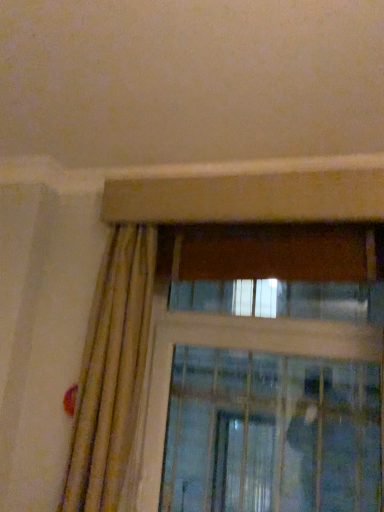
What do you see at coordinates (112, 372) in the screenshot? This screenshot has width=384, height=512. I see `beige textured curtain at left` at bounding box center [112, 372].

The height and width of the screenshot is (512, 384). What are the coordinates of `beige textured curtain at left` in the screenshot? It's located at (112, 372).

Measure the distance between beige textured curtain at left and camera.

A distance of 4.16 feet exists between beige textured curtain at left and camera.

Where is `clear glass screen door at upper center`? The width and height of the screenshot is (384, 512). clear glass screen door at upper center is located at coordinates (271, 434).

Describe the element at coordinates (271, 434) in the screenshot. The image size is (384, 512). I see `clear glass screen door at upper center` at that location.

Locate an element on the screen. This screenshot has height=512, width=384. beige textured curtain at left is located at coordinates (112, 372).

Is clear glass screen door at upper center at the left side of beige textured curtain at left?

No, clear glass screen door at upper center is not to the left of beige textured curtain at left.

Is clear glass screen door at upper center positioned in front of beige textured curtain at left?

No, it is not.

Does point (376, 496) appear closer or farther from the camera than point (97, 376)?

Clearly, point (376, 496) is more distant from the camera than point (97, 376).

From the image's perspective, which object appears higher, clear glass screen door at upper center or beige textured curtain at left?

beige textured curtain at left.

From a real-world perspective, is clear glass screen door at upper center below beige textured curtain at left?

Indeed, from a real-world perspective, clear glass screen door at upper center is positioned beneath beige textured curtain at left.

Looking at this image, considering the sizes of objects clear glass screen door at upper center and beige textured curtain at left in the image provided, who is wider, clear glass screen door at upper center or beige textured curtain at left?

Wider between the two is beige textured curtain at left.

Considering the sizes of clear glass screen door at upper center and beige textured curtain at left in the image, is clear glass screen door at upper center taller or shorter than beige textured curtain at left?

clear glass screen door at upper center is shorter than beige textured curtain at left.

Considering the sizes of objects clear glass screen door at upper center and beige textured curtain at left in the image provided, who is bigger, clear glass screen door at upper center or beige textured curtain at left?

With larger size is clear glass screen door at upper center.

Is clear glass screen door at upper center outside of beige textured curtain at left?

Indeed, clear glass screen door at upper center is completely outside beige textured curtain at left.

Is clear glass screen door at upper center positioned far away from beige textured curtain at left?

Actually, clear glass screen door at upper center and beige textured curtain at left are a little close together.

Is clear glass screen door at upper center aimed at beige textured curtain at left?

Yes, clear glass screen door at upper center is turned towards beige textured curtain at left.

Find the location of a particular element. The width and height of the screenshot is (384, 512). curtain in front of the clear glass screen door at upper center is located at coordinates (112, 372).

Considering the relative positions of beige textured curtain at left and clear glass screen door at upper center in the image provided, is beige textured curtain at left to the right of clear glass screen door at upper center from the viewer's perspective?

No.

Is beige textured curtain at left positioned behind clear glass screen door at upper center?

That is False.

Does point (107, 338) appear closer or farther from the camera than point (169, 441)?

Point (107, 338) is positioned closer to the camera compared to point (169, 441).

From the image's perspective, is beige textured curtain at left located above or below clear glass screen door at upper center?

From the image's perspective, beige textured curtain at left appears above clear glass screen door at upper center.

From a real-world perspective, does beige textured curtain at left sit lower than clear glass screen door at upper center?

No.

Considering the sizes of objects beige textured curtain at left and clear glass screen door at upper center in the image provided, who is thinner, beige textured curtain at left or clear glass screen door at upper center?

clear glass screen door at upper center is thinner.

Which of these two, beige textured curtain at left or clear glass screen door at upper center, stands shorter?

clear glass screen door at upper center.

Does beige textured curtain at left have a smaller size compared to clear glass screen door at upper center?

Indeed, beige textured curtain at left has a smaller size compared to clear glass screen door at upper center.

From the picture: Would you say beige textured curtain at left contains clear glass screen door at upper center?

No, clear glass screen door at upper center is not inside beige textured curtain at left.

Is the surface of beige textured curtain at left in direct contact with clear glass screen door at upper center?

No, beige textured curtain at left is not beside clear glass screen door at upper center.

Is beige textured curtain at left oriented away from clear glass screen door at upper center?

No, beige textured curtain at left's orientation is not away from clear glass screen door at upper center.

Identify the location of screen door on the right of beige textured curtain at left. Image resolution: width=384 pixels, height=512 pixels. (271, 434).

The width and height of the screenshot is (384, 512). In the image, there is a beige textured curtain at left. Find the location of `screen door below it (from a real-world perspective)`. screen door below it (from a real-world perspective) is located at coordinates (271, 434).

The height and width of the screenshot is (512, 384). Find the location of `screen door behind the beige textured curtain at left`. screen door behind the beige textured curtain at left is located at coordinates (271, 434).